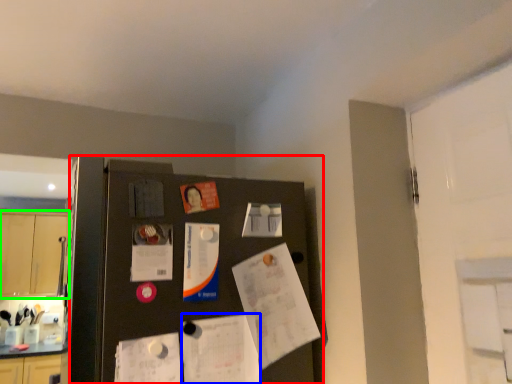
Question: Which is nearer to the fridge (highlighted by a red box)? poster (highlighted by a blue box) or cabinetry (highlighted by a green box).

Choices:
 (A) poster
 (B) cabinetry

Answer: (A)